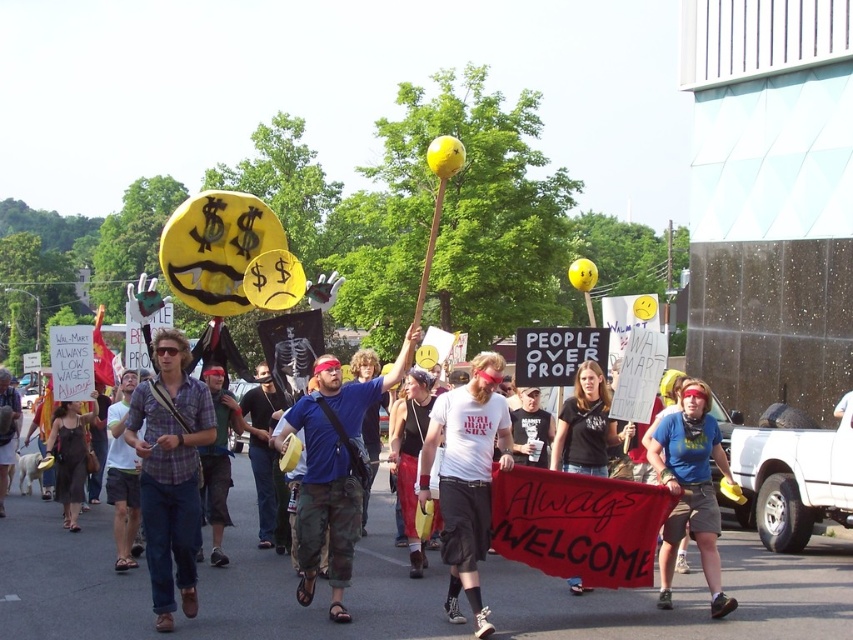
Question: Which point is farther to the camera?

Choices:
 (A) camouflage pants at center
 (B) denim pants at center

Answer: (B)

Question: Among these objects, which one is farthest from the camera?

Choices:
 (A) denim pants at center
 (B) camouflage pants at center

Answer: (A)

Question: Is camouflage pants at center above denim pants at center?

Choices:
 (A) no
 (B) yes

Answer: (B)

Question: Is camouflage pants at center to the left of denim pants at center from the viewer's perspective?

Choices:
 (A) no
 (B) yes

Answer: (A)

Question: Is camouflage pants at center closer to camera compared to denim pants at center?

Choices:
 (A) no
 (B) yes

Answer: (B)